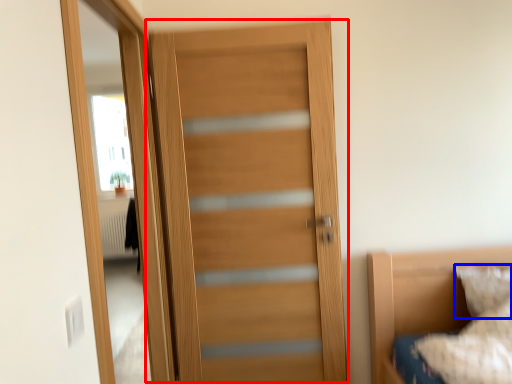
Question: Which of the following is the farthest to the observer, door (highlighted by a red box) or pillow (highlighted by a blue box)?

Choices:
 (A) door
 (B) pillow

Answer: (B)